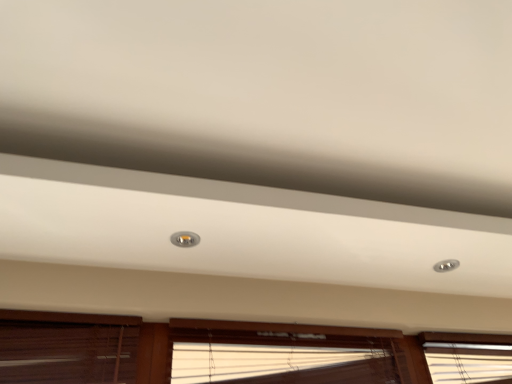
Question: Would you say translucent bamboo blinds at lower center, acting as the second window starting from the right, is a long distance from brown wood blinds at lower left, positioned as the 3th window in right-to-left order?

Choices:
 (A) yes
 (B) no

Answer: (B)

Question: From the image's perspective, is translucent bamboo blinds at lower center, acting as the second window starting from the right, below brown wood blinds at lower left, placed as the 1th window when sorted from left to right?

Choices:
 (A) yes
 (B) no

Answer: (A)

Question: Is translucent bamboo blinds at lower center, the 2th window positioned from the left, bigger than brown wood blinds at lower left, placed as the 1th window when sorted from left to right?

Choices:
 (A) no
 (B) yes

Answer: (B)

Question: Considering the relative sizes of translucent bamboo blinds at lower center, acting as the second window starting from the right, and brown wood blinds at lower left, positioned as the 3th window in right-to-left order, in the image provided, is translucent bamboo blinds at lower center, acting as the second window starting from the right, shorter than brown wood blinds at lower left, positioned as the 3th window in right-to-left order,?

Choices:
 (A) no
 (B) yes

Answer: (B)

Question: Is translucent bamboo blinds at lower center, acting as the second window starting from the right, to the right of brown wood blinds at lower left, placed as the 1th window when sorted from left to right, from the viewer's perspective?

Choices:
 (A) yes
 (B) no

Answer: (A)

Question: In the image, is wooden blinds at lower center, placed as the 3th window when sorted from left to right, on the left side or the right side of brown wood blinds at lower left, positioned as the 3th window in right-to-left order?

Choices:
 (A) right
 (B) left

Answer: (A)

Question: From the image's perspective, is wooden blinds at lower center, which is the first window from right to left, above or below brown wood blinds at lower left, placed as the 1th window when sorted from left to right?

Choices:
 (A) above
 (B) below

Answer: (B)

Question: Considering the positions of wooden blinds at lower center, which is the first window from right to left, and brown wood blinds at lower left, placed as the 1th window when sorted from left to right, in the image, is wooden blinds at lower center, which is the first window from right to left, taller or shorter than brown wood blinds at lower left, placed as the 1th window when sorted from left to right,?

Choices:
 (A) short
 (B) tall

Answer: (B)

Question: In the image, is wooden blinds at lower center, placed as the 3th window when sorted from left to right, positioned in front of or behind brown wood blinds at lower left, positioned as the 3th window in right-to-left order?

Choices:
 (A) behind
 (B) front

Answer: (A)

Question: Is matte silver droplight at center situated inside brown wood blinds at lower left, positioned as the 3th window in right-to-left order, or outside?

Choices:
 (A) outside
 (B) inside

Answer: (A)

Question: Is matte silver droplight at center taller or shorter than brown wood blinds at lower left, positioned as the 3th window in right-to-left order?

Choices:
 (A) short
 (B) tall

Answer: (A)

Question: Visually, is matte silver droplight at center positioned to the left or to the right of brown wood blinds at lower left, placed as the 1th window when sorted from left to right?

Choices:
 (A) right
 (B) left

Answer: (A)

Question: Based on their sizes in the image, would you say matte silver droplight at center is bigger or smaller than brown wood blinds at lower left, placed as the 1th window when sorted from left to right?

Choices:
 (A) big
 (B) small

Answer: (B)

Question: Is wooden blinds at lower center, which is the first window from right to left, wider or thinner than matte silver droplight at center?

Choices:
 (A) wide
 (B) thin

Answer: (B)

Question: Does point (317, 345) appear closer or farther from the camera than point (175, 240)?

Choices:
 (A) farther
 (B) closer

Answer: (A)